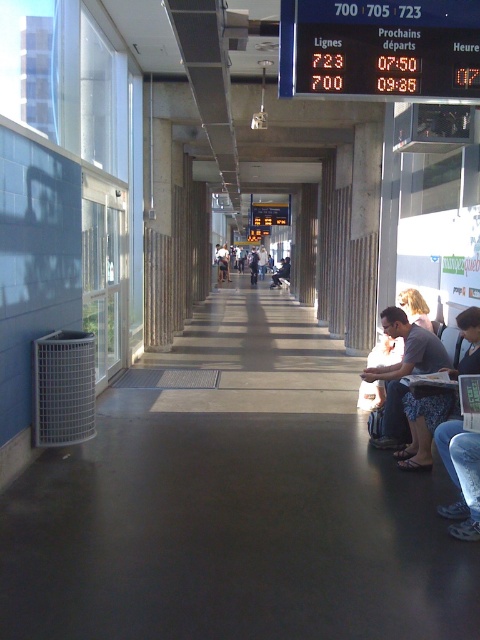
Question: Does blue denim shorts at lower right have a greater width compared to matte gray backpack at center?

Choices:
 (A) no
 (B) yes

Answer: (A)

Question: Can you confirm if gray fabric shirt at lower right is positioned below blue denim shorts at lower right?

Choices:
 (A) yes
 (B) no

Answer: (B)

Question: Does blue denim shorts at lower right appear on the left side of matte gray backpack at center?

Choices:
 (A) no
 (B) yes

Answer: (A)

Question: Which object is positioned farthest from the gray fabric shirt at lower right?

Choices:
 (A) white cotton shirt at center
 (B) matte gray backpack at center
 (C) blue denim shorts at lower right

Answer: (B)

Question: Which object is the closest to the matte gray backpack at center?

Choices:
 (A) white cotton shirt at center
 (B) gray fabric shirt at lower right
 (C) blue denim shorts at lower right

Answer: (A)

Question: Which of the following is the farthest from the observer?

Choices:
 (A) white cotton shirt at center
 (B) blue denim shorts at lower right

Answer: (A)